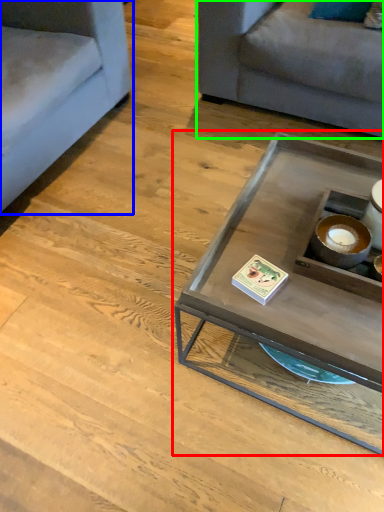
Question: Estimate the real-world distances between objects in this image. Which object is farther from coffee table (highlighted by a red box), studio couch (highlighted by a blue box) or studio couch (highlighted by a green box)?

Choices:
 (A) studio couch
 (B) studio couch

Answer: (A)